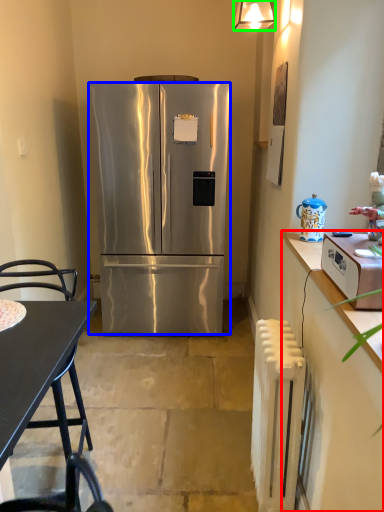
Question: Based on their relative distances, which object is nearer to cabinetry (highlighted by a red box)? Choose from refrigerator (highlighted by a blue box) and lamp (highlighted by a green box).

Choices:
 (A) refrigerator
 (B) lamp

Answer: (A)